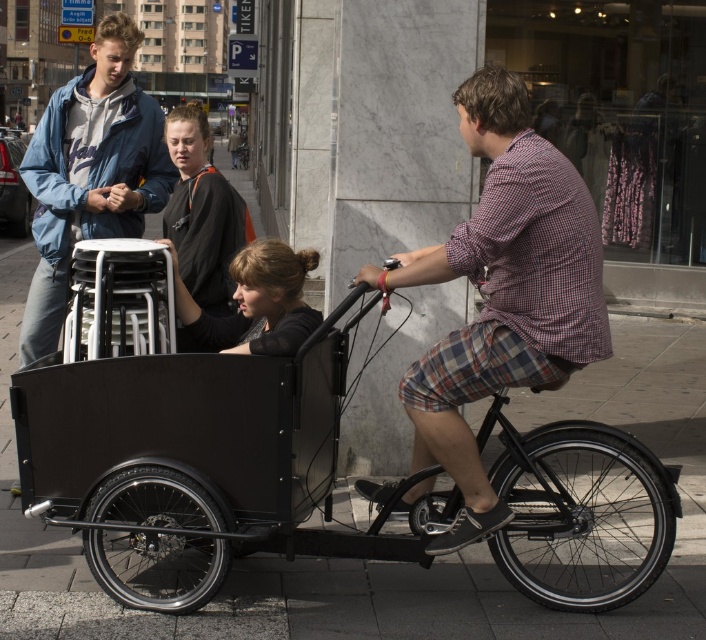
Does point (253, 396) lie in front of point (83, 72)?

Yes, point (253, 396) is in front of point (83, 72).

Who is more forward, (221,433) or (59,148)?

Positioned in front is point (221,433).

Where is `black matte cargo bike at center`? The image size is (706, 640). black matte cargo bike at center is located at coordinates (189, 445).

Is black matte cargo bike at center shorter than black fabric jacket at center?

Incorrect, black matte cargo bike at center's height does not fall short of black fabric jacket at center's.

The width and height of the screenshot is (706, 640). What do you see at coordinates (189, 445) in the screenshot?
I see `black matte cargo bike at center` at bounding box center [189, 445].

Does point (299, 433) lie in front of point (244, 220)?

That is True.

Locate an element on the screen. Image resolution: width=706 pixels, height=640 pixels. black matte cargo bike at center is located at coordinates (189, 445).

Based on the photo, between plaid cotton shorts at center and black fabric jacket at center, which one has less height?

black fabric jacket at center

The image size is (706, 640). What do you see at coordinates (502, 292) in the screenshot?
I see `plaid cotton shorts at center` at bounding box center [502, 292].

This screenshot has width=706, height=640. Identify the location of plaid cotton shorts at center. (502, 292).